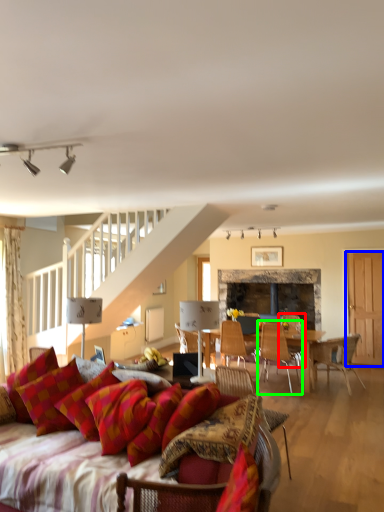
Question: Which object is positioned closest to chair (highlighted by a red box)? Select from glass door (highlighted by a blue box) and chair (highlighted by a green box).

Choices:
 (A) glass door
 (B) chair

Answer: (B)